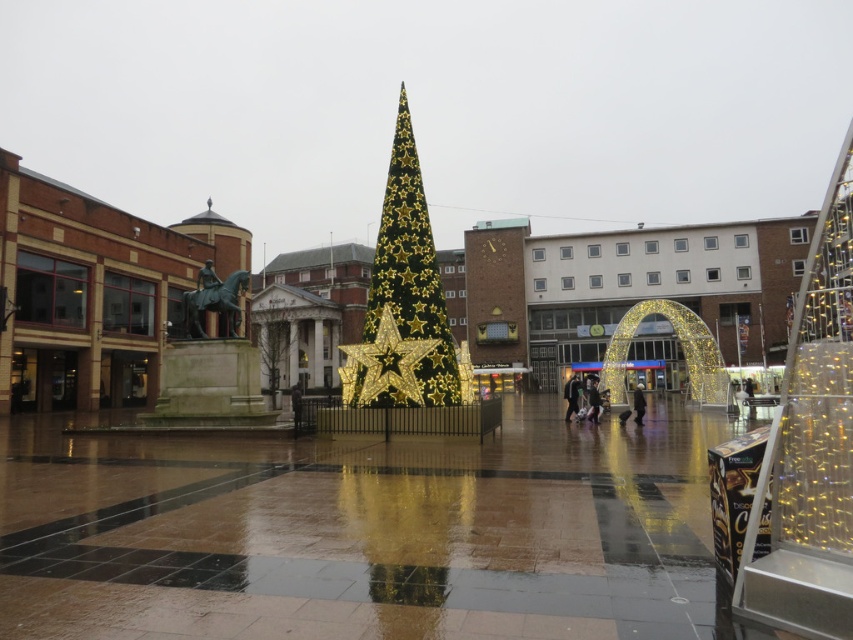
Question: Which object appears closest to the camera in this image?

Choices:
 (A) gold metallic tree at center
 (B) dark blue jeans at lower right
 (C) gold metallic star at center
 (D) green glittery christmas tree at center

Answer: (C)

Question: Is the position of gold metallic tree at center less distant than that of dark brown leather jacket at lower right?

Choices:
 (A) yes
 (B) no

Answer: (B)

Question: Which is farther from the green glittery christmas tree at center?

Choices:
 (A) gold metallic tree at center
 (B) dark brown leather jacket at lower right
 (C) dark blue jeans at lower right
 (D) matte black jacket at center

Answer: (A)

Question: Is green glittery christmas tree at center to the right of gold metallic star at center from the viewer's perspective?

Choices:
 (A) no
 (B) yes

Answer: (B)

Question: Is dark brown leather jacket at lower right thinner than dark blue jeans at lower right?

Choices:
 (A) no
 (B) yes

Answer: (B)

Question: Which is nearer to the green glittery christmas tree at center?

Choices:
 (A) gold metallic tree at center
 (B) dark blue jeans at lower right
 (C) matte black jacket at center
 (D) gold metallic star at center

Answer: (D)